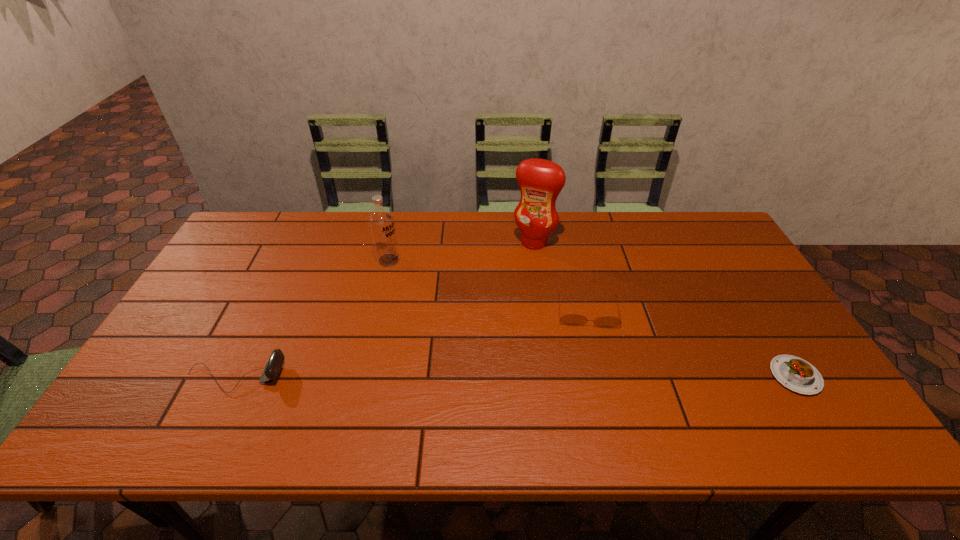
I want to click on vacant position at the far left corner of the desktop, so click(233, 248).

Where is `free space between the sunglasses and the farthest object`? The width and height of the screenshot is (960, 540). free space between the sunglasses and the farthest object is located at coordinates (561, 276).

Find the location of a particular element. This screenshot has height=540, width=960. vacant space that's between the tallest object and the rightmost object is located at coordinates click(664, 309).

I want to click on free spot between the tallest object and the rightmost object, so click(664, 309).

Image resolution: width=960 pixels, height=540 pixels. I want to click on free space between the fourth nearest object and the tallest object, so click(x=461, y=251).

Identify the location of vacant point located between the condiment and the leftmost object. (384, 309).

Where is `vacant region between the third farthest object and the second object from left to right`? vacant region between the third farthest object and the second object from left to right is located at coordinates (488, 286).

Where is `vacant space that's between the rightmost object and the leftmost object`? The width and height of the screenshot is (960, 540). vacant space that's between the rightmost object and the leftmost object is located at coordinates (515, 376).

At what (x,y) coordinates should I click in order to perform the action: click on free space between the leftmost object and the condiment. Please return your answer as a coordinate pair (x, y). Image resolution: width=960 pixels, height=540 pixels. Looking at the image, I should click on (384, 309).

Image resolution: width=960 pixels, height=540 pixels. In order to click on vacant space that is in between the sunglasses and the condiment in this screenshot , I will do `click(561, 276)`.